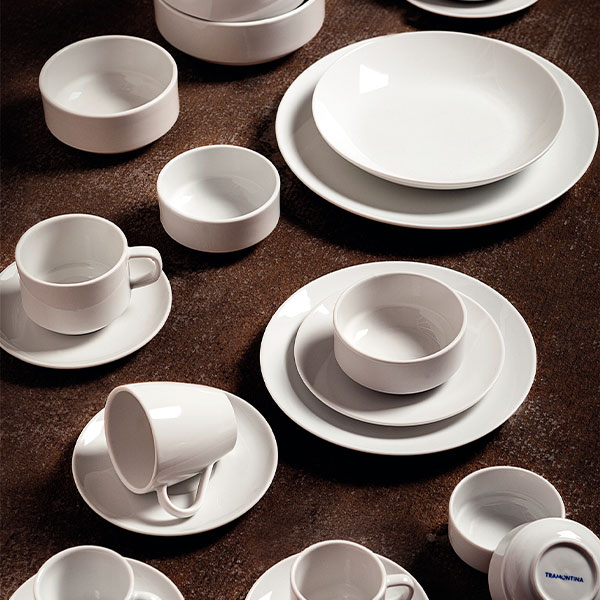
You are a GUI agent. You are given a task and a screenshot of the screen. Output one action in this format:
    pyautogui.click(x=<x>, y=<y>)
    Task: Click on the this bowl is tipped over
    The height and width of the screenshot is (600, 600).
    Given the screenshot: What is the action you would take?
    pyautogui.click(x=520, y=544)